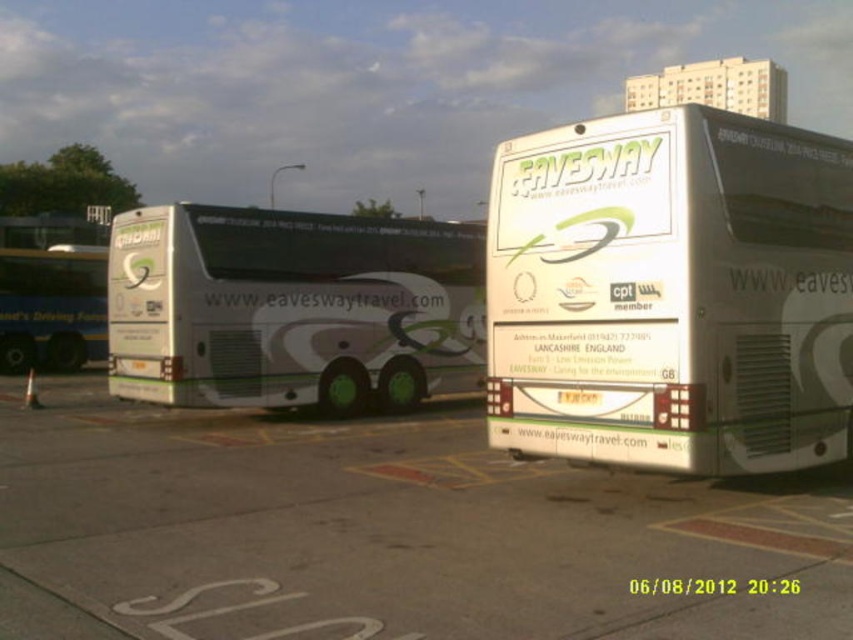
Who is shorter, concrete pavement at center or green matte bus at left?

Standing shorter between the two is concrete pavement at center.

Does concrete pavement at center have a smaller size compared to green matte bus at left?

No.

At what (x,y) coordinates should I click in order to perform the action: click on concrete pavement at center. Please return your answer as a coordinate pair (x, y). Looking at the image, I should click on (380, 532).

Can you confirm if concrete pavement at center is smaller than white matte bus at left?

Yes, concrete pavement at center is smaller than white matte bus at left.

Is concrete pavement at center behind white matte bus at left?

No, concrete pavement at center is closer to the viewer.

Image resolution: width=853 pixels, height=640 pixels. I want to click on concrete pavement at center, so click(380, 532).

Does white matte bus at center appear on the right side of green matte bus at left?

Indeed, white matte bus at center is positioned on the right side of green matte bus at left.

How much distance is there between white matte bus at center and green matte bus at left?

The distance of white matte bus at center from green matte bus at left is 21.08 meters.

Find the location of a particular element. white matte bus at center is located at coordinates (671, 292).

This screenshot has width=853, height=640. In order to click on white matte bus at center in this screenshot , I will do (671, 292).